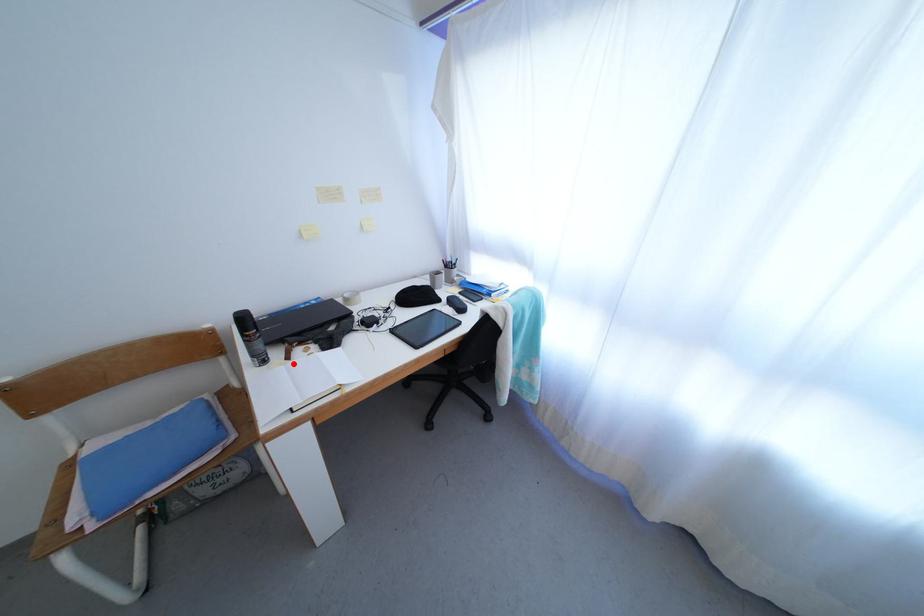
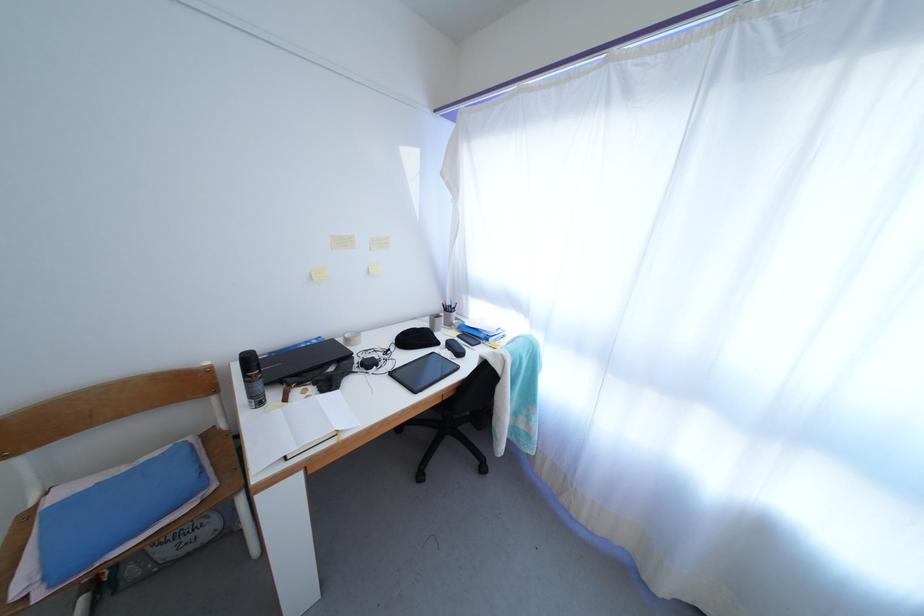
Where in the second image is the point corresponding to the highlighted location from the first image?

(290, 406)